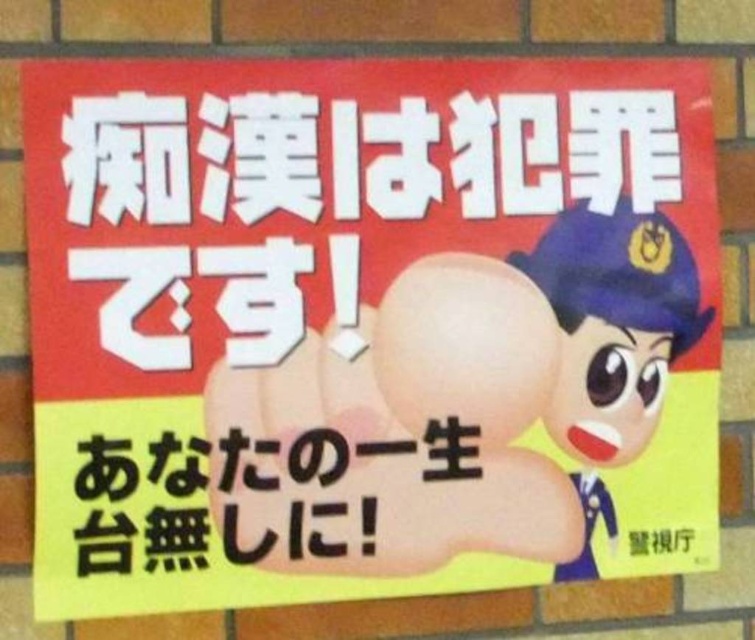
Who is shorter, shiny blue uniform at right or black paper at lower center?

black paper at lower center

Can you confirm if shiny blue uniform at right is positioned to the right of black paper at lower center?

Yes, shiny blue uniform at right is to the right of black paper at lower center.

Image resolution: width=755 pixels, height=640 pixels. I want to click on shiny blue uniform at right, so click(x=612, y=344).